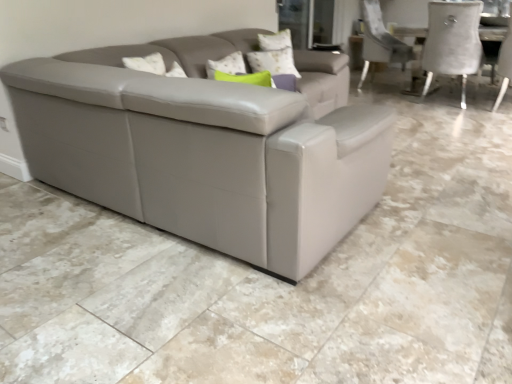
Find the location of a particular element. The height and width of the screenshot is (384, 512). free space to the left of white fabric chair at right is located at coordinates (454, 108).